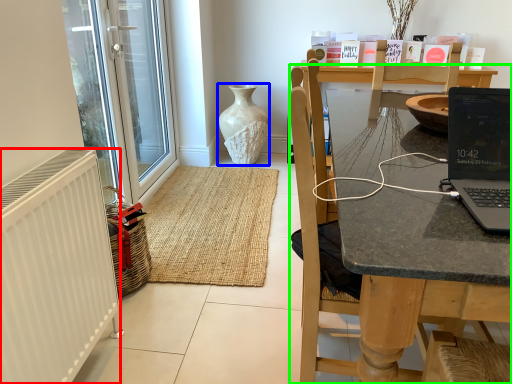
Question: Which is farther away from radiator (highlighted by a red box)? vase (highlighted by a blue box) or chair (highlighted by a green box)?

Choices:
 (A) vase
 (B) chair

Answer: (A)